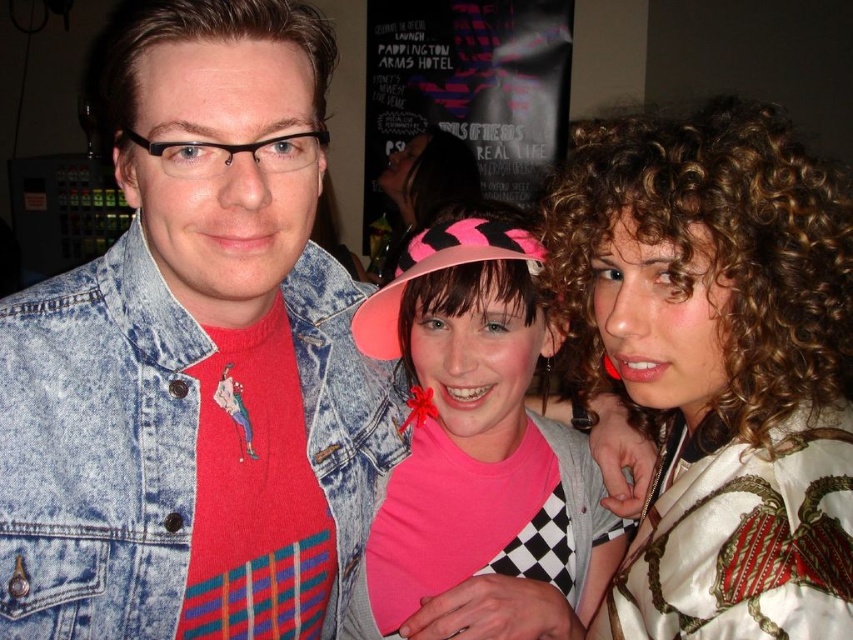
Question: From the image, what is the correct spatial relationship of white satin blouse at center in relation to silky white robe with red and gold patterns at right?

Choices:
 (A) left
 (B) right

Answer: (B)

Question: Which of the following is the farthest from the observer?

Choices:
 (A) (596, 208)
 (B) (769, 522)
 (C) (440, 209)
 (D) (502, 442)

Answer: (D)

Question: Can you confirm if silky white robe with red and gold patterns at right is positioned to the left of pink fabric hat at center?

Choices:
 (A) yes
 (B) no

Answer: (B)

Question: Which object is positioned closest to the pink matte hat at center?

Choices:
 (A) faded denim jacket at upper left
 (B) silky white robe with red and gold patterns at right
 (C) pink fabric hat at center

Answer: (A)

Question: Estimate the real-world distances between objects in this image. Which object is farther from the faded denim jacket at upper left?

Choices:
 (A) white satin blouse at center
 (B) pink matte hat at center
 (C) silky white robe with red and gold patterns at right

Answer: (C)

Question: Does white satin blouse at center appear on the left side of faded denim jacket at upper left?

Choices:
 (A) yes
 (B) no

Answer: (B)